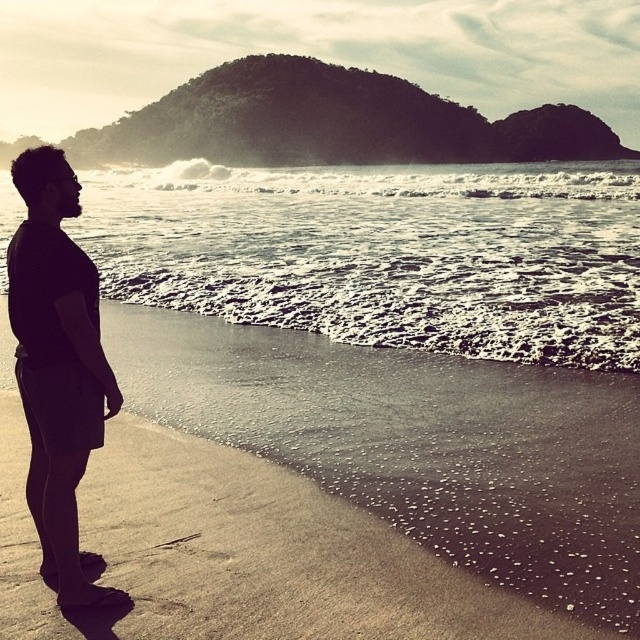
Question: Based on their relative distances, which object is farther from the white frothy water at center?

Choices:
 (A) black matte shorts at left
 (B) sandy beach at lower left

Answer: (B)

Question: Does sandy beach at lower left have a lesser width compared to black matte shorts at left?

Choices:
 (A) no
 (B) yes

Answer: (B)

Question: Does sandy beach at lower left have a lesser width compared to black matte shorts at left?

Choices:
 (A) yes
 (B) no

Answer: (A)

Question: Can you confirm if sandy beach at lower left is positioned to the right of black matte shorts at left?

Choices:
 (A) no
 (B) yes

Answer: (B)

Question: Which point is farther to the camera?

Choices:
 (A) sandy beach at lower left
 (B) white frothy water at center
 (C) black matte shorts at left

Answer: (B)

Question: Estimate the real-world distances between objects in this image. Which object is closer to the sandy beach at lower left?

Choices:
 (A) black matte shorts at left
 (B) white frothy water at center

Answer: (A)